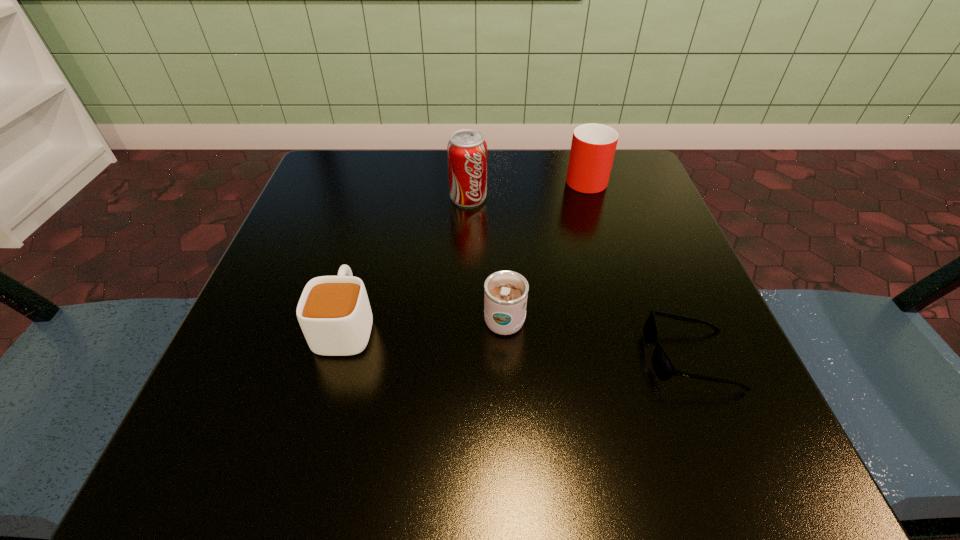
Identify which object is the second nearest to the leftmost cup. Please provide its 2D coordinates. Your answer should be formatted as a tuple, i.e. [(x, y)], where the tuple contains the x and y coordinates of a point satisfying the conditions above.

[(467, 150)]

Identify which cup is the third closest to the shortest object. Please provide its 2D coordinates. Your answer should be formatted as a tuple, i.e. [(x, y)], where the tuple contains the x and y coordinates of a point satisfying the conditions above.

[(334, 313)]

Select which cup is the closest to the shortest object. Please provide its 2D coordinates. Your answer should be formatted as a tuple, i.e. [(x, y)], where the tuple contains the x and y coordinates of a point satisfying the conditions above.

[(505, 292)]

Where is `vacant region that satisfies the following two spatial constraints: 1. on the side with the handle of the second shortest object; 2. on the left side of the soda can`? This screenshot has width=960, height=540. vacant region that satisfies the following two spatial constraints: 1. on the side with the handle of the second shortest object; 2. on the left side of the soda can is located at coordinates (381, 198).

This screenshot has height=540, width=960. Identify the location of free location that satisfies the following two spatial constraints: 1. on the side with the handle of the leftmost object; 2. on the left side of the tallest object. click(381, 198).

The image size is (960, 540). Find the location of `free location that satisfies the following two spatial constraints: 1. on the side with the handle of the tallest object; 2. on the left side of the leftmost cup`. free location that satisfies the following two spatial constraints: 1. on the side with the handle of the tallest object; 2. on the left side of the leftmost cup is located at coordinates (381, 198).